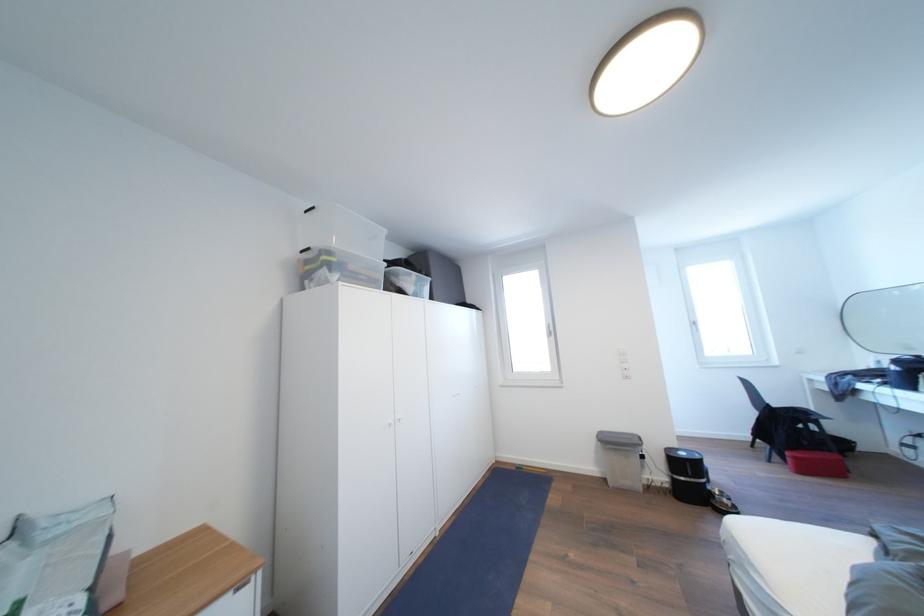
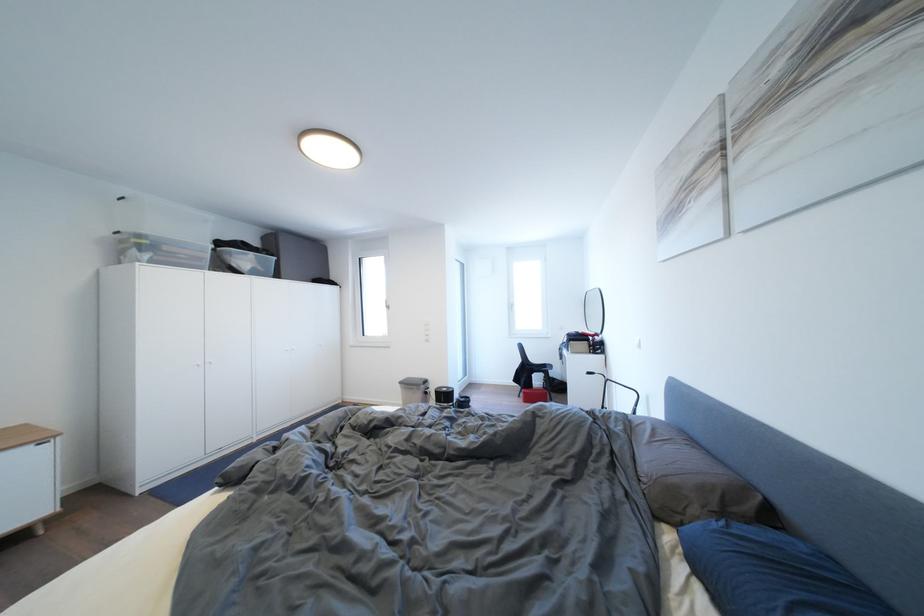
Locate, in the second image, the point that corresponds to pixel 336 257 in the first image.

(149, 241)